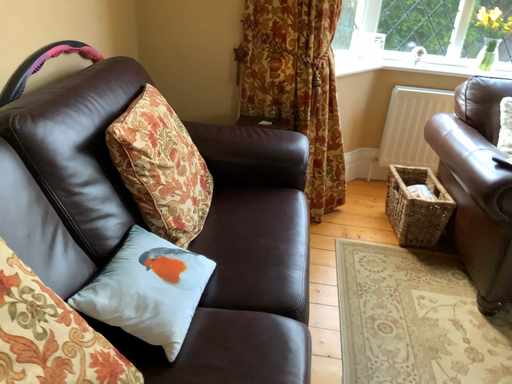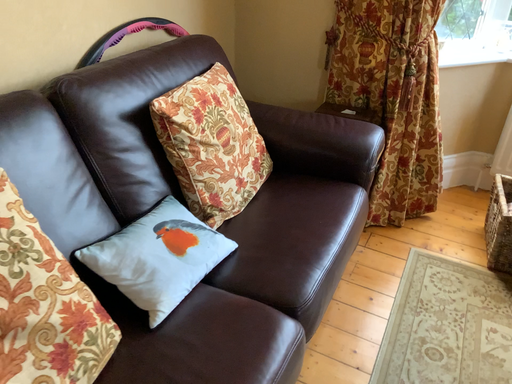
Question: How did the camera likely rotate when shooting the video?

Choices:
 (A) rotated left
 (B) rotated right

Answer: (A)